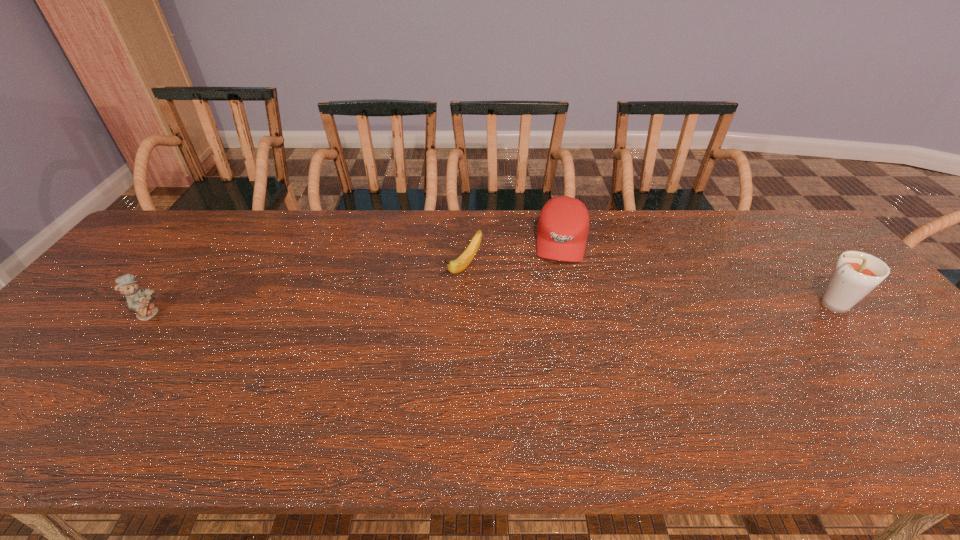
You are a GUI agent. You are given a task and a screenshot of the screen. Output one action in this format:
    pyautogui.click(x=<x>, y=<y>)
    Task: Click on the vacant space on the desktop that is between the leftmost object and the tallest object and is positioned on the front-facing side of the third object from left to right
    The height and width of the screenshot is (540, 960).
    Given the screenshot: What is the action you would take?
    pyautogui.click(x=555, y=308)

Where is `vacant spot on the desktop that is between the leftmost object and the root beer and is positioned at the stem of the shortest object`? This screenshot has height=540, width=960. vacant spot on the desktop that is between the leftmost object and the root beer and is positioned at the stem of the shortest object is located at coordinates (426, 309).